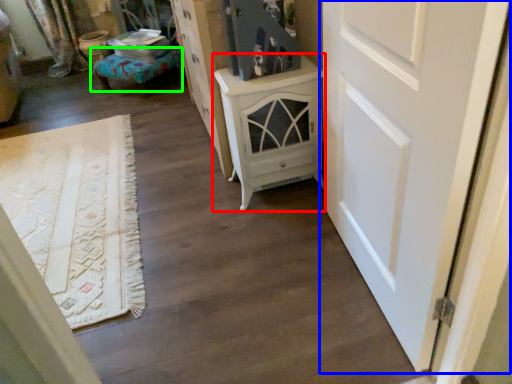
Question: Based on their relative distances, which object is nearer to chest of drawers (highlighted by a red box)? Choose from door (highlighted by a blue box) and furniture (highlighted by a green box).

Choices:
 (A) door
 (B) furniture

Answer: (A)